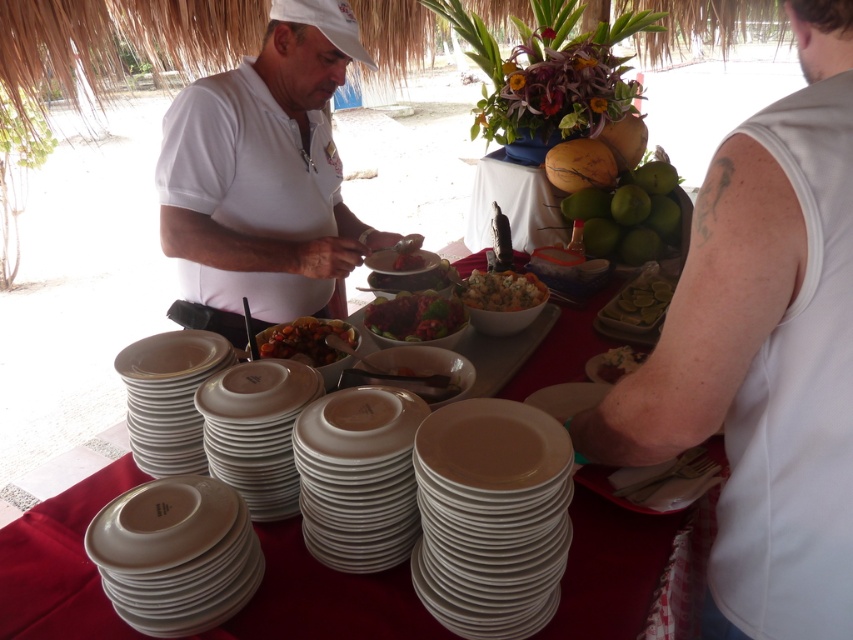
You are a guest at the buffet and want to choose a plate to serve yourself. The white glossy plate at lower left and the matte brown plate at lower right are both available. Which plate has a larger width?

The white glossy plate at lower left has a larger width than the matte brown plate at lower right.

You are standing at the buffet table and want to pick up two items. The first item is located at point [309,595] and the second item is at point [318,346]. Which item will be easier to reach without moving your position?

The item at point [309,595] will be easier to reach because it is closer to you than the item at point [318,346].

You are a guest at the buffet and you see the white matte shirt at right and the matte white plate at center. Which object is positioned lower from the ground?

The white matte shirt at right is located below the matte white plate at center, so the white matte shirt at right is positioned lower from the ground.